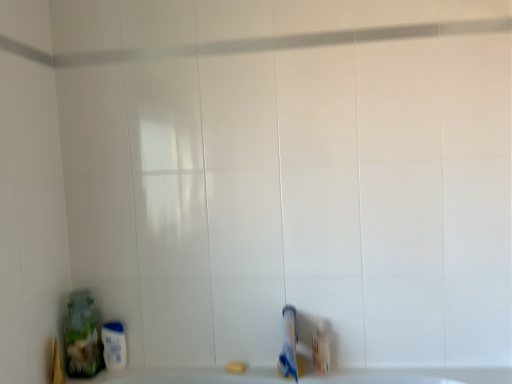
Question: Is translucent plastic bottle at lower right to the right of yellow matte bar of soap at lower center from the viewer's perspective?

Choices:
 (A) no
 (B) yes

Answer: (B)

Question: From the image's perspective, is translucent plastic bottle at lower right located beneath yellow matte bar of soap at lower center?

Choices:
 (A) yes
 (B) no

Answer: (B)

Question: Does translucent plastic bottle at lower right have a larger size compared to yellow matte bar of soap at lower center?

Choices:
 (A) yes
 (B) no

Answer: (A)

Question: Is yellow matte bar of soap at lower center completely or partially inside translucent plastic bottle at lower right?

Choices:
 (A) yes
 (B) no

Answer: (B)

Question: Can you confirm if translucent plastic bottle at lower right is taller than yellow matte bar of soap at lower center?

Choices:
 (A) no
 (B) yes

Answer: (B)

Question: Considering the positions of yellow matte bar of soap at lower center and blue matte toothpaste at lower center in the image, is yellow matte bar of soap at lower center wider or thinner than blue matte toothpaste at lower center?

Choices:
 (A) wide
 (B) thin

Answer: (B)

Question: From a real-world perspective, is yellow matte bar of soap at lower center above or below blue matte toothpaste at lower center?

Choices:
 (A) above
 (B) below

Answer: (B)

Question: Considering their positions, is yellow matte bar of soap at lower center located in front of or behind blue matte toothpaste at lower center?

Choices:
 (A) front
 (B) behind

Answer: (B)

Question: Based on their positions, is yellow matte bar of soap at lower center located to the left or right of blue matte toothpaste at lower center?

Choices:
 (A) left
 (B) right

Answer: (A)

Question: Considering the positions of point 294,331 and point 318,329, is point 294,331 closer or farther from the camera than point 318,329?

Choices:
 (A) farther
 (B) closer

Answer: (B)

Question: Relative to translucent plastic bottle at lower right, is blue matte toothpaste at lower center in front or behind?

Choices:
 (A) front
 (B) behind

Answer: (A)

Question: From the image's perspective, is blue matte toothpaste at lower center above or below translucent plastic bottle at lower right?

Choices:
 (A) above
 (B) below

Answer: (A)

Question: From a real-world perspective, relative to translucent plastic bottle at lower right, is blue matte toothpaste at lower center vertically above or below?

Choices:
 (A) below
 (B) above

Answer: (B)

Question: In terms of width, does translucent plastic bottle at lower right look wider or thinner when compared to yellow matte bar of soap at lower center?

Choices:
 (A) wide
 (B) thin

Answer: (A)

Question: From a real-world perspective, is translucent plastic bottle at lower right above or below yellow matte bar of soap at lower center?

Choices:
 (A) above
 (B) below

Answer: (A)